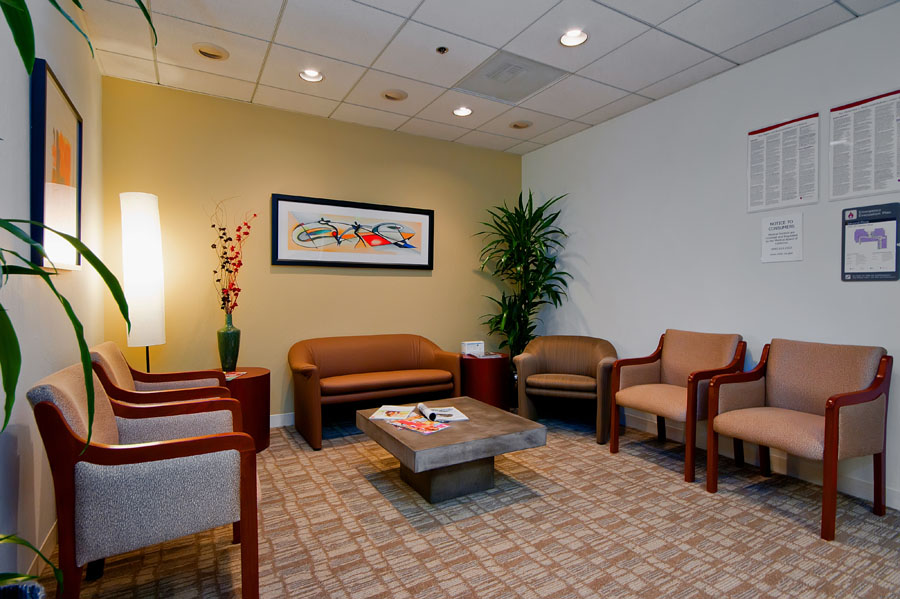
Locate an element on the screen. white wall is located at coordinates (694, 257).